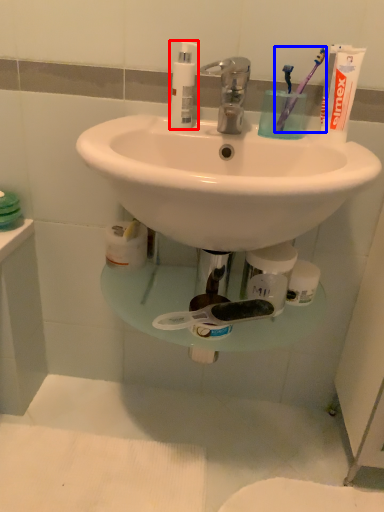
Question: Among these objects, which one is farthest to the camera, soap dispenser (highlighted by a red box) or toothbrush (highlighted by a blue box)?

Choices:
 (A) soap dispenser
 (B) toothbrush

Answer: (A)